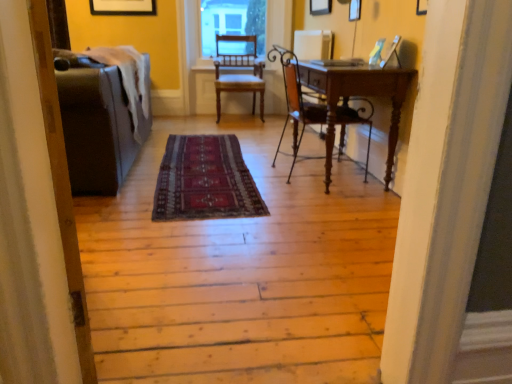
Locate an element on the screen. The width and height of the screenshot is (512, 384). vacant space in front of dark red woven rug at center is located at coordinates (236, 244).